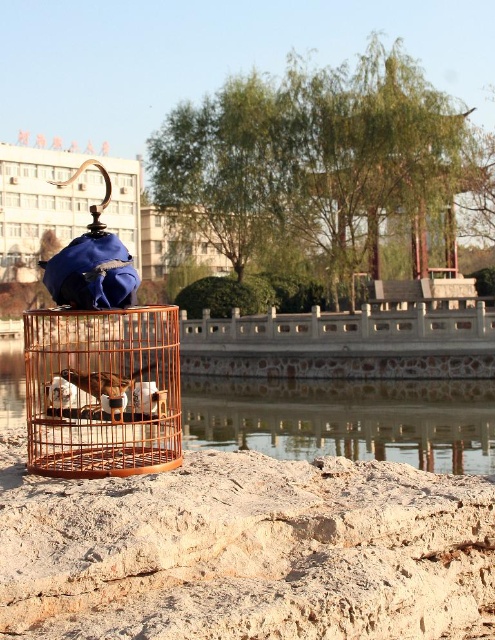
You are standing at the point marked by the coordinates point (346, 422) in the image. What do you see directly below you?

The point (346, 422) marks transparent glass water at center, so you are standing on transparent glass water at center.

You are standing at the edge of the water and want to place a small floating device in the water. Considering the position of the brown wooden birdcage at center and the transparent glass water at center, where should you place the device to ensure it floats freely without being obstructed by the birdcage?

The transparent glass water at center is located below the brown wooden birdcage at center. Therefore, you should place the floating device in the transparent glass water at center below the birdcage to avoid obstruction.